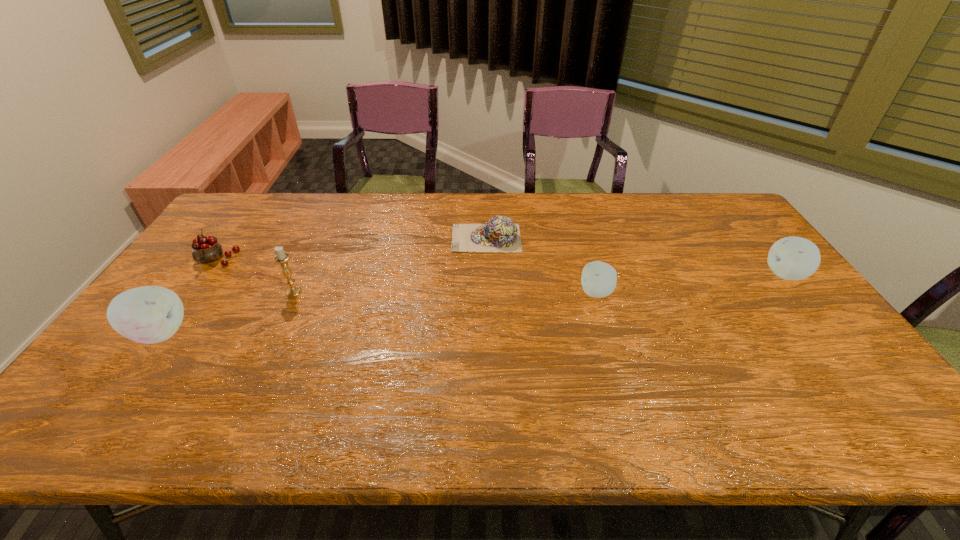
Locate an element on the screen. The height and width of the screenshot is (540, 960). the tallest apple is located at coordinates (151, 314).

The image size is (960, 540). Identify the location of the nearest object. (151, 314).

The height and width of the screenshot is (540, 960). In order to click on the shortest apple in this screenshot , I will do `click(599, 279)`.

Find the location of a particular element. The image size is (960, 540). the second object from right to left is located at coordinates coord(599,279).

You are a GUI agent. You are given a task and a screenshot of the screen. Output one action in this format:
    pyautogui.click(x=<x>, y=<y>)
    Task: Click on the rightmost object
    
    Given the screenshot: What is the action you would take?
    pyautogui.click(x=791, y=258)

Find the location of a particular element. This screenshot has height=540, width=960. the rightmost apple is located at coordinates (791, 258).

Identify the location of the fourth object from right to left. (281, 257).

Find the location of a particular element. Image resolution: width=960 pixels, height=540 pixels. cherry is located at coordinates (207, 249).

This screenshot has width=960, height=540. Find the location of `cap`. cap is located at coordinates (500, 234).

You are a GUI agent. You are given a task and a screenshot of the screen. Output one action in this format:
    pyautogui.click(x=<x>, y=<y>)
    Task: Click on the shortest object
    
    Given the screenshot: What is the action you would take?
    pyautogui.click(x=500, y=234)